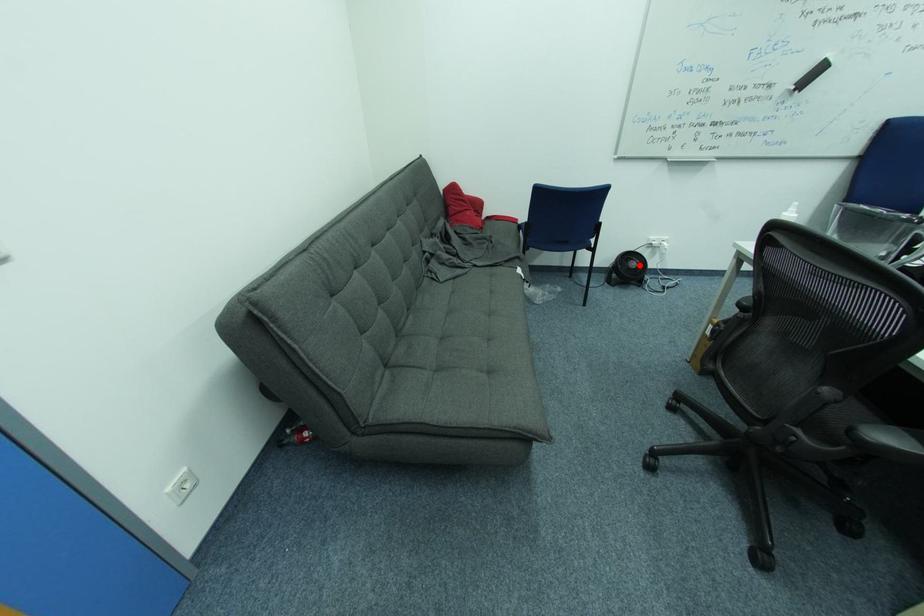
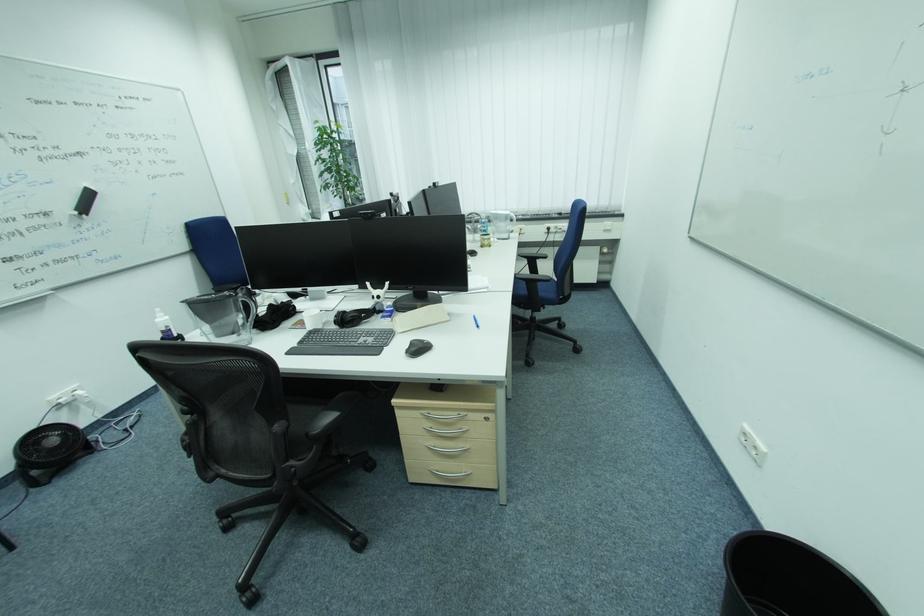
The point at the highlighted location is marked in the first image. Where is the corresponding point in the second image?

(59, 442)